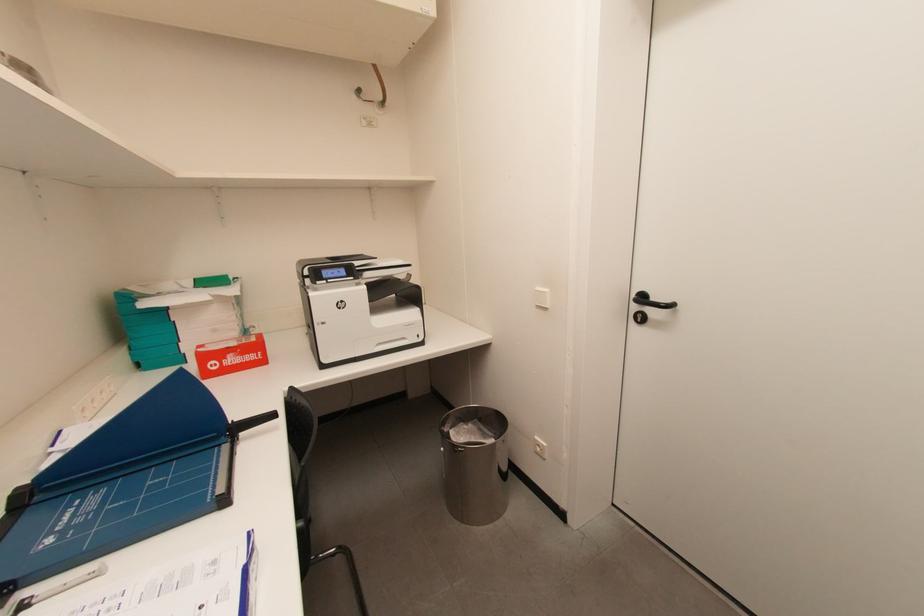
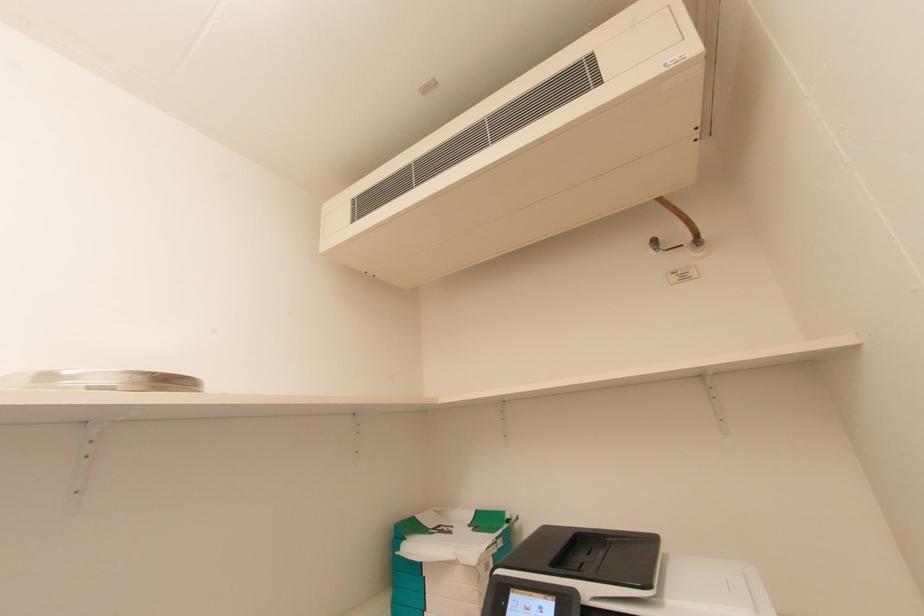
Based on the photo, the first image is from the beginning of the video and the second image is from the end. How did the camera likely rotate when shooting the video?

The rotation direction of the camera is left-up.